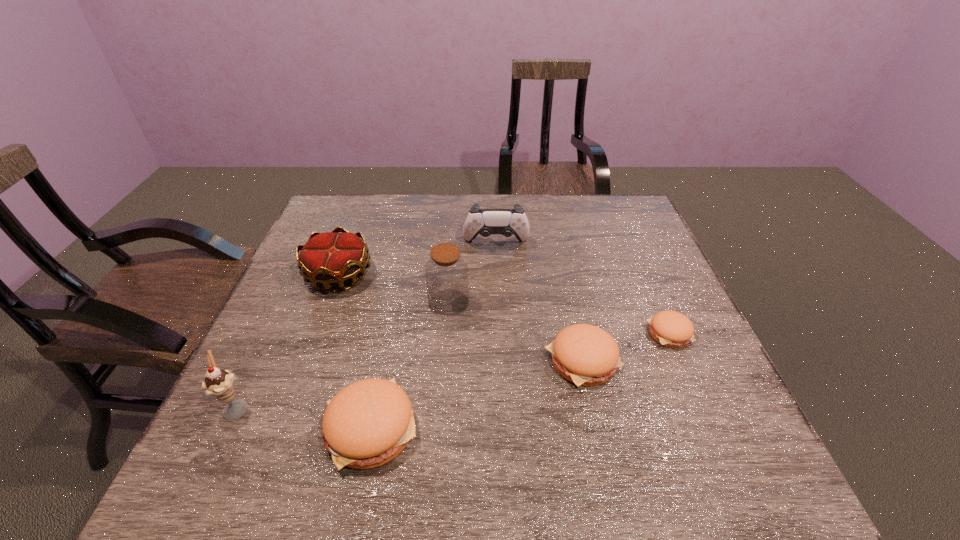
Locate an element on the screen. icecream at the left edge is located at coordinates (219, 383).

Find the location of a particular element. The height and width of the screenshot is (540, 960). object that is at the right edge is located at coordinates (672, 329).

Find the location of a particular element. Image resolution: width=960 pixels, height=540 pixels. object that is positioned at the near left corner is located at coordinates (219, 383).

Locate an element on the screen. This screenshot has width=960, height=540. vacant area at the far edge of the desktop is located at coordinates (409, 230).

In the image, there is a desktop. Identify the location of vacant space at the near edge. (557, 404).

This screenshot has height=540, width=960. I want to click on free spot at the left edge of the desktop, so click(x=283, y=339).

Where is `vacant region at the right edge of the desktop`? Image resolution: width=960 pixels, height=540 pixels. vacant region at the right edge of the desktop is located at coordinates (629, 328).

What are the coordinates of `vacant region at the far left corner of the desktop` in the screenshot? It's located at (336, 211).

In the image, there is a desktop. Identify the location of vacant space at the far right corner. 643,227.

Where is `free space at the near right corner of the desktop`? free space at the near right corner of the desktop is located at coordinates (701, 431).